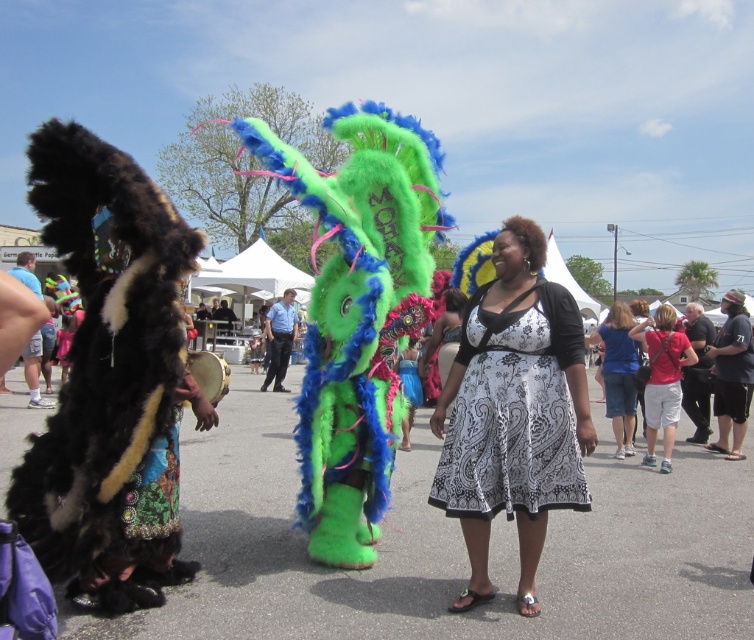
Question: Can you confirm if red cotton shirt at right is smaller than blue denim jeans at center?

Choices:
 (A) yes
 (B) no

Answer: (A)

Question: Which is nearer to the black cotton shirt at right?

Choices:
 (A) red cotton shirt at right
 (B) blue denim skirt at center
 (C) white cotton shorts at lower right
 (D) blue denim jeans at center

Answer: (C)

Question: Among these objects, which one is nearest to the camera?

Choices:
 (A) blue denim jeans at center
 (B) blue denim skirt at center
 (C) blue denim shorts at lower right
 (D) red cotton shirt at right

Answer: (D)

Question: Is blue denim shorts at lower right positioned before blue denim jeans at center?

Choices:
 (A) yes
 (B) no

Answer: (A)

Question: Is white printed dress at center smaller than red cotton shirt at right?

Choices:
 (A) yes
 (B) no

Answer: (B)

Question: Which point appears closest to the camera in this image?

Choices:
 (A) (607, 378)
 (B) (657, 348)
 (C) (538, 413)
 (D) (737, 406)

Answer: (C)